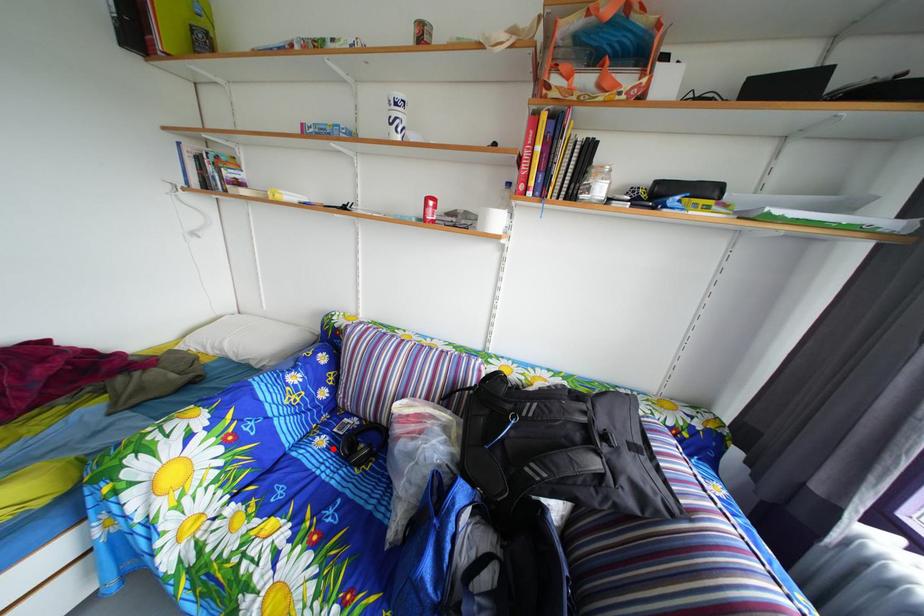
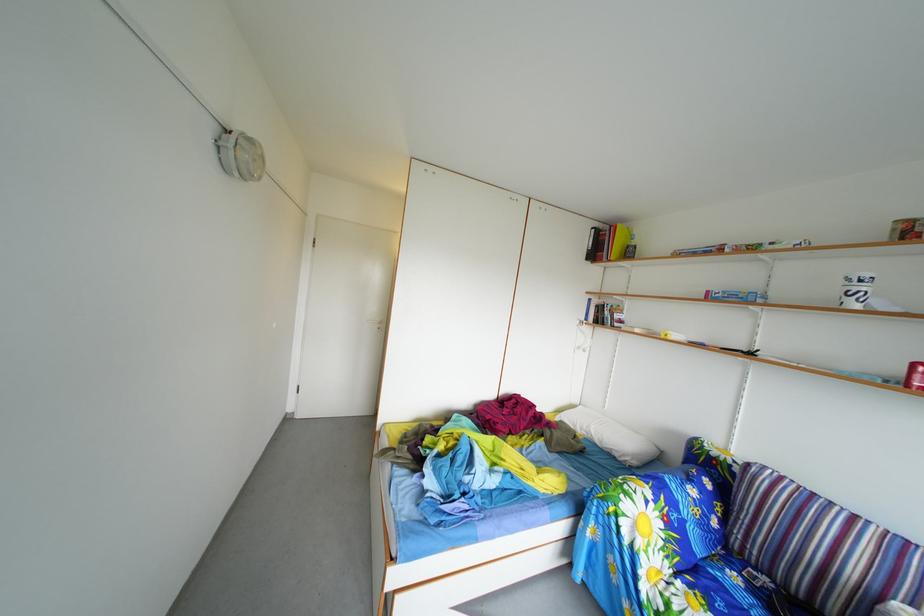
In the second image, find the point that corresponds to the highlighted location in the first image.

(746, 585)